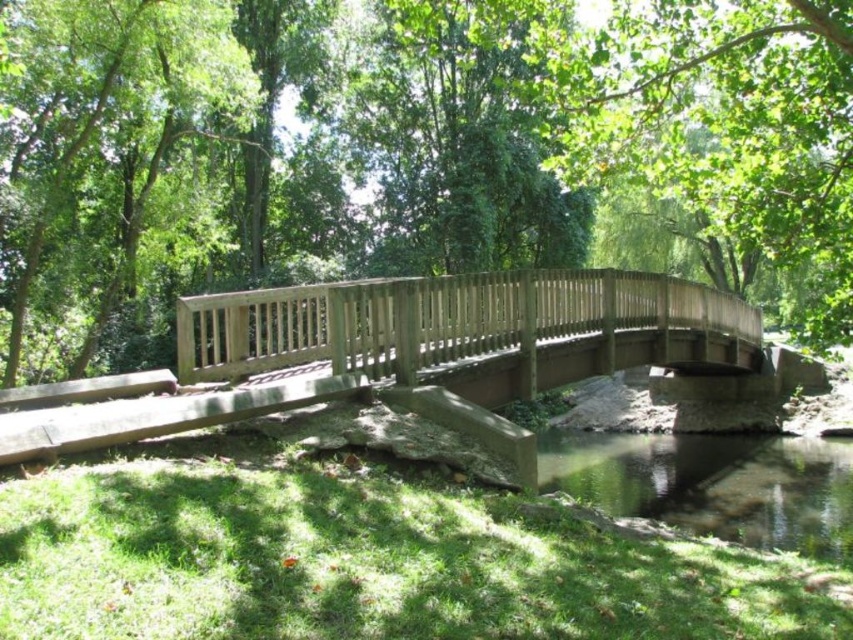
Question: Which point appears closest to the camera in this image?

Choices:
 (A) (828, 284)
 (B) (520, 385)
 (C) (827, 552)

Answer: (B)

Question: Is green matte bridge at center above wooden bridge at center?

Choices:
 (A) yes
 (B) no

Answer: (A)

Question: Which is farther from the green leafy tree at center?

Choices:
 (A) green matte bridge at center
 (B) wooden bridge at center
 (C) clear water at lower center

Answer: (C)

Question: Is green matte bridge at center positioned in front of green leafy tree at center?

Choices:
 (A) no
 (B) yes

Answer: (B)

Question: Which is farther from the green leafy tree at center?

Choices:
 (A) green matte bridge at center
 (B) clear water at lower center

Answer: (B)

Question: Is green leafy tree at center wider than wooden bridge at center?

Choices:
 (A) yes
 (B) no

Answer: (B)